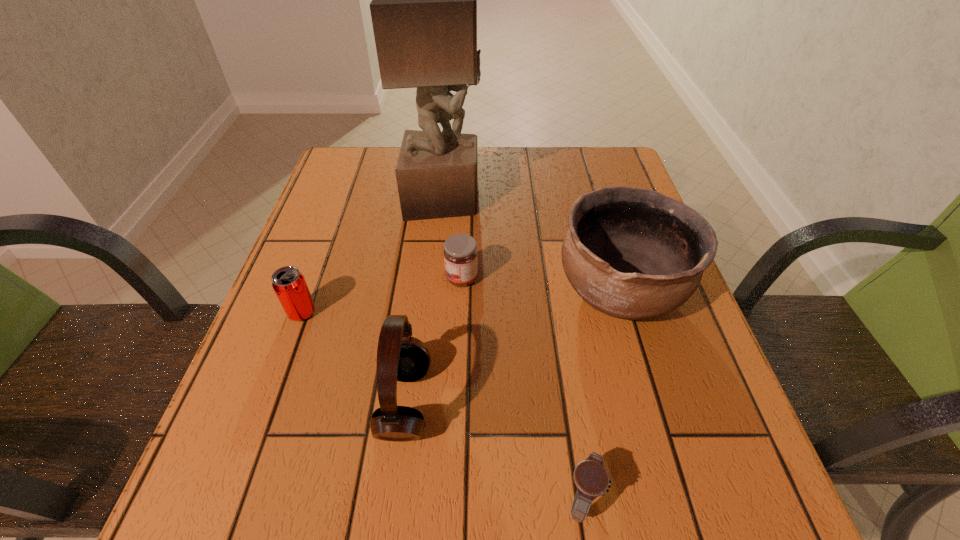
Identify the location of the farthest object. This screenshot has width=960, height=540. (424, 0).

This screenshot has height=540, width=960. What are the coordinates of `the tallest object` in the screenshot? It's located at (424, 0).

What are the coordinates of `the fifth farthest object` in the screenshot? It's located at (400, 357).

Where is `pottery`? pottery is located at coordinates (631, 253).

You are a GUI agent. You are given a task and a screenshot of the screen. Output one action in this format:
    pyautogui.click(x=<x>, y=<y>)
    Task: Click on the soda can
    Image resolution: width=960 pixels, height=540 pixels.
    Given the screenshot: What is the action you would take?
    pyautogui.click(x=289, y=284)

This screenshot has height=540, width=960. In order to click on jam in this screenshot , I will do `click(460, 252)`.

I want to click on the nearest object, so click(590, 477).

Where is `the shortest object`? the shortest object is located at coordinates (590, 477).

The image size is (960, 540). I want to click on vacant space located 0.280m on the front-facing side of the farthest object, so click(x=590, y=199).

Image resolution: width=960 pixels, height=540 pixels. In order to click on free space located 0.200m on the ear pads of the headset in this screenshot , I will do `click(551, 403)`.